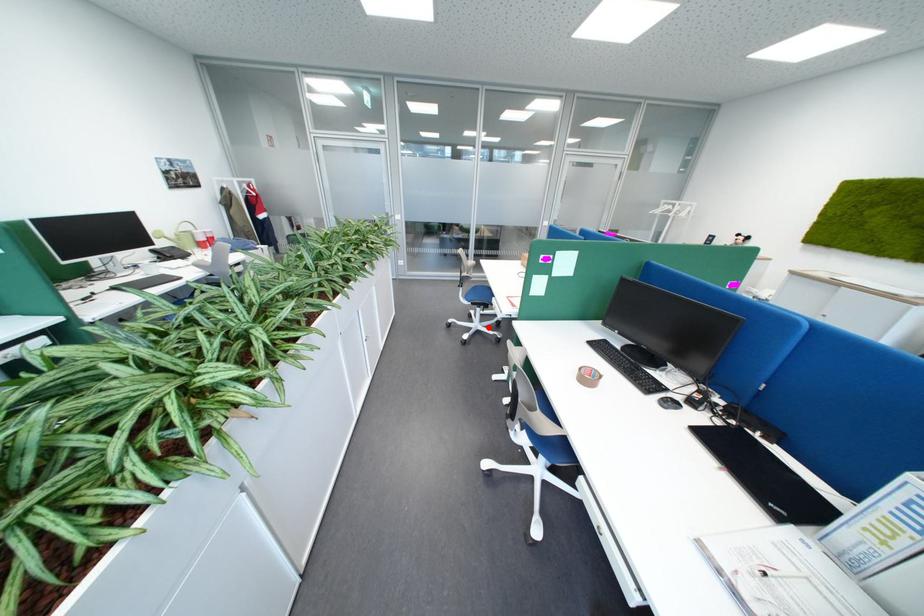
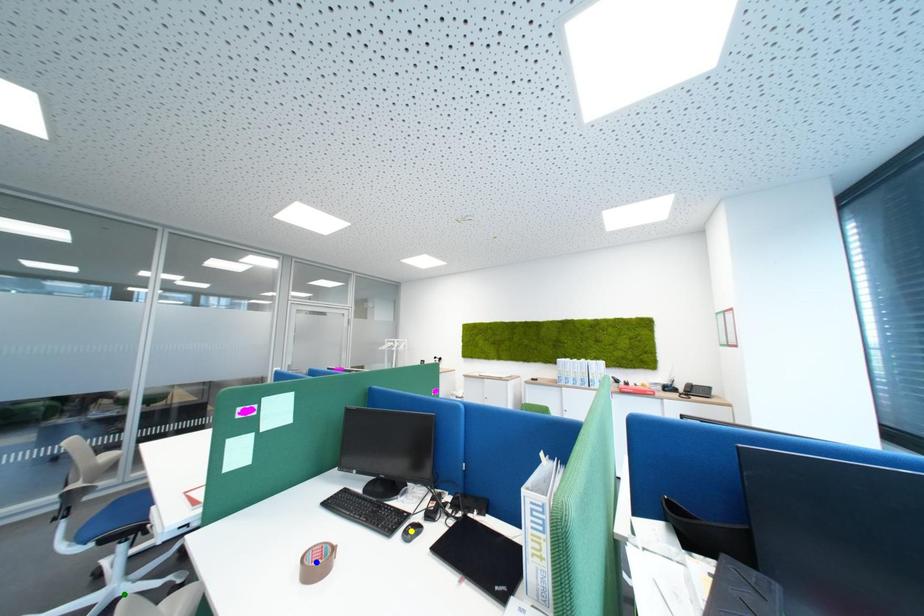
Question: I am providing you with two images of the same scene from different viewpoints. A red point is marked on the first image. You are given multiple points on the second image. Which point in image 2 is actually the same real-world point as the red point in image 1?

Choices:
 (A) green point
 (B) blue point
 (C) yellow point

Answer: (A)